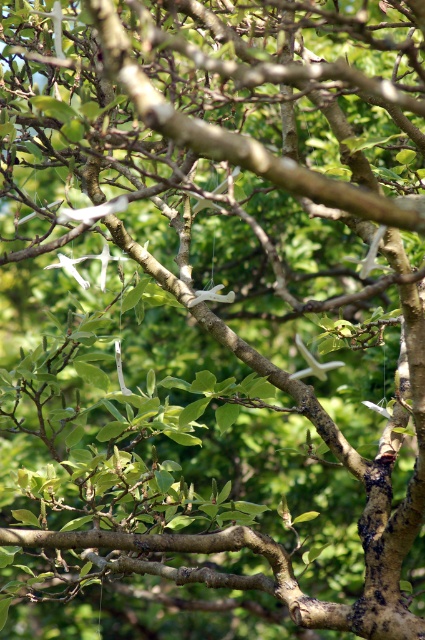
Question: Estimate the real-world distances between objects in this image. Which object is closer to the white matte bird at upper center?

Choices:
 (A) white matte bird at center
 (B) white matte branch at center

Answer: (B)

Question: Considering the real-world distances, which object is closest to the white matte branch at center?

Choices:
 (A) white matte bird at upper center
 (B) white matte bird at center

Answer: (B)

Question: Which of the following is the farthest from the observer?

Choices:
 (A) (116, 196)
 (B) (325, 374)
 (C) (223, 296)

Answer: (C)

Question: Can you confirm if white matte branch at center is wider than white matte bird at center?

Choices:
 (A) yes
 (B) no

Answer: (B)

Question: Can you confirm if white matte branch at center is bigger than white matte bird at center?

Choices:
 (A) no
 (B) yes

Answer: (A)

Question: Can you confirm if white matte bird at upper center is positioned above white matte branch at center?

Choices:
 (A) yes
 (B) no

Answer: (A)